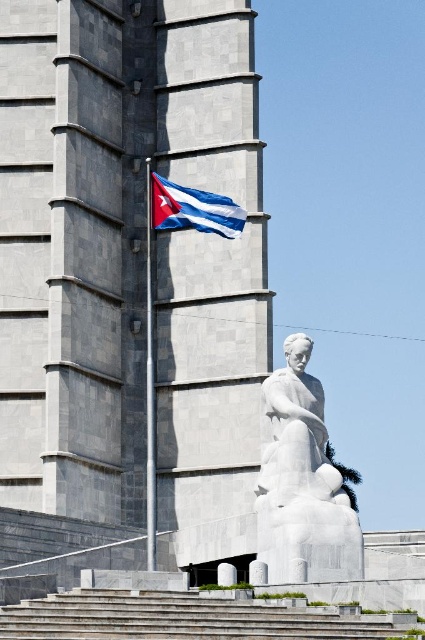
From the picture: You are standing at the entrance of the plaza and see the smooth concrete tower at center and the gray concrete stairs at lower center. Which one is more to the left?

The smooth concrete tower at center is positioned on the left side of gray concrete stairs at lower center, so it is more to the left.

You are standing at the entrance of the building and want to take a photo of the white marble statue at center. Which direction should you face to ensure the statue is in the frame?

The white marble statue at center is located at point (303,480), which is towards the lower right from your position at the entrance. You should face towards the lower right direction to capture the statue in your photo.